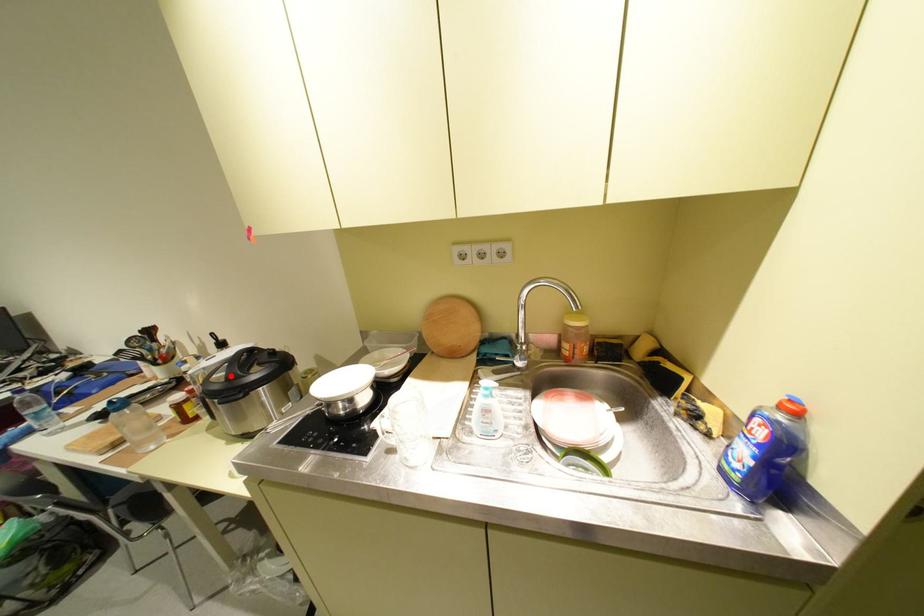
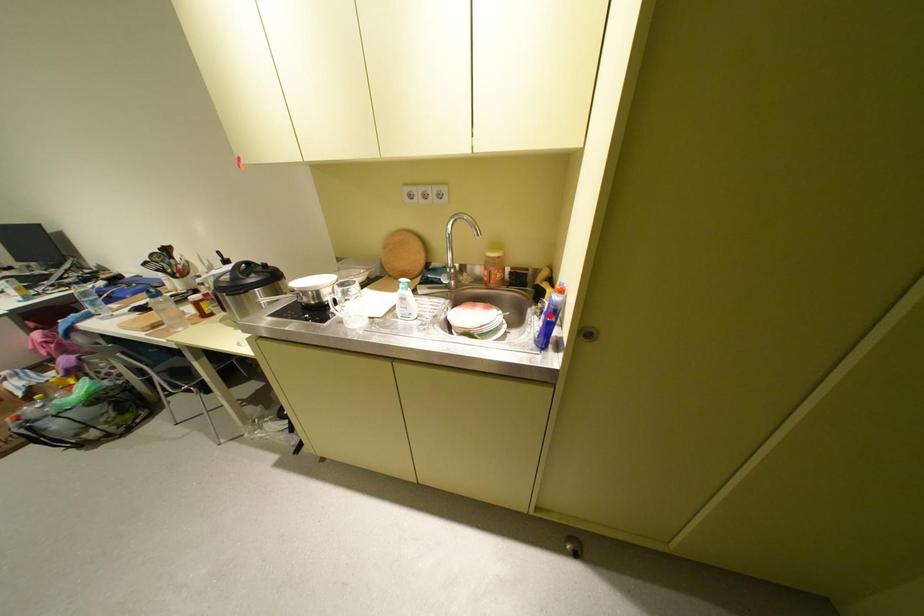
I am providing you with two images of the same scene from different viewpoints. A red point is marked on the first image and another point is marked on the second image. Is the red point in image1 aligned with the point shown in image2?

No